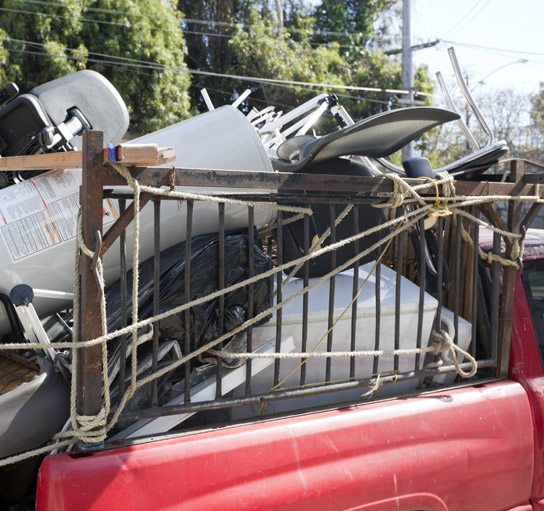
Locate an element on the screen. The width and height of the screenshot is (544, 511). bottom of chair is located at coordinates (40, 120).